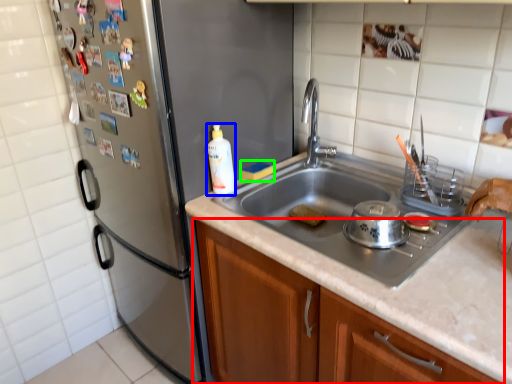
Question: Based on their relative distances, which object is nearer to cabinetry (highlighted by a red box)? Choose from bottle (highlighted by a blue box) and food (highlighted by a green box).

Choices:
 (A) bottle
 (B) food

Answer: (A)